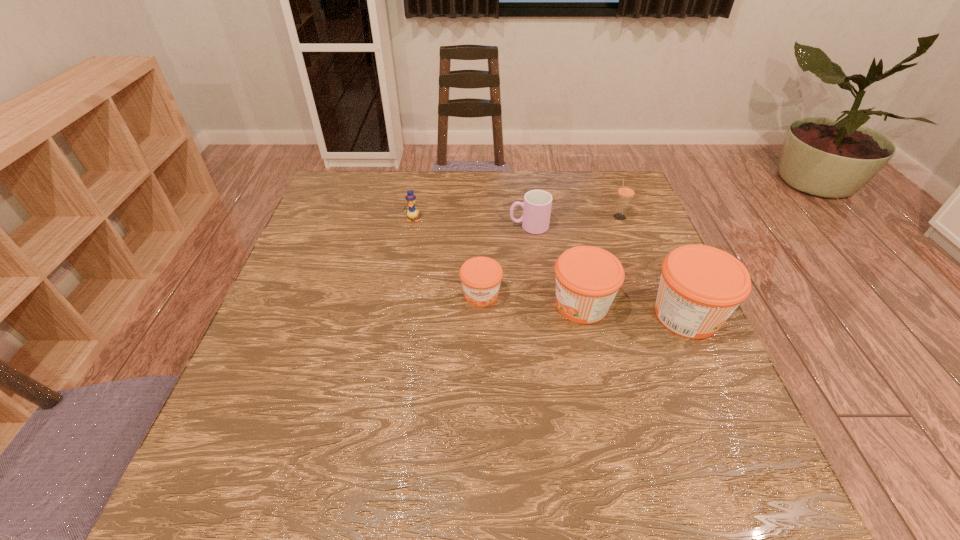
Locate an element on the screen. The image size is (960, 540). the shortest jam is located at coordinates (481, 277).

Where is `the fifth object from right to left`? the fifth object from right to left is located at coordinates (481, 277).

Where is `the second jam from left to right`? the second jam from left to right is located at coordinates (588, 278).

The image size is (960, 540). In order to click on the rightmost jam in this screenshot , I will do `click(700, 287)`.

Identify the location of the leftmost object. (412, 213).

Image resolution: width=960 pixels, height=540 pixels. Identify the location of cup. (537, 204).

Locate an element on the screen. This screenshot has width=960, height=540. straw is located at coordinates (626, 191).

Find the location of `vacant space located on the front label of the second object from left to right`. vacant space located on the front label of the second object from left to right is located at coordinates [481, 338].

What are the coordinates of `free space located on the front label of the second jam from right to left` in the screenshot? It's located at (403, 305).

I want to click on vacant area situated on the front label of the second jam from right to left, so click(433, 305).